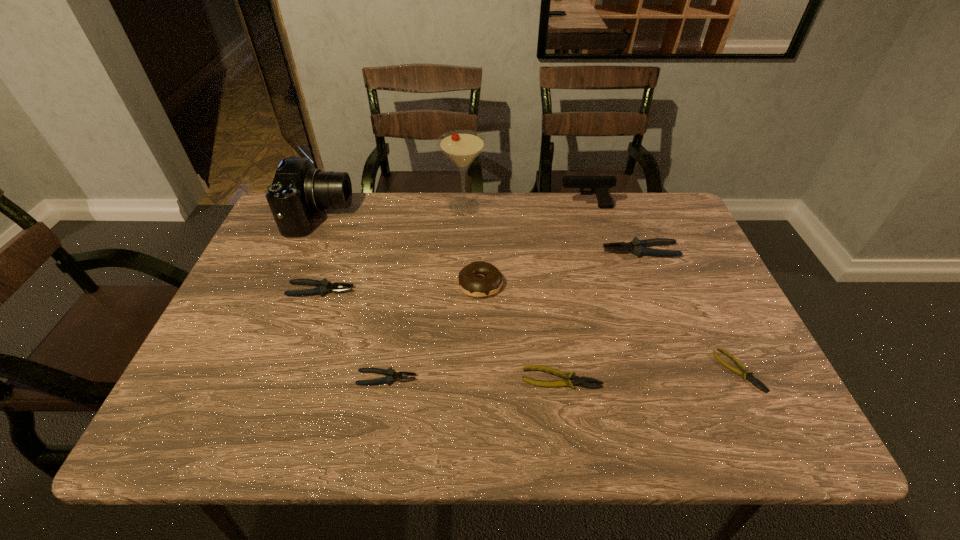
Where is `vacant point located between the second shortest pliers and the fifth shortest object`? vacant point located between the second shortest pliers and the fifth shortest object is located at coordinates (601, 315).

At what (x,y) coordinates should I click in order to perform the action: click on free space between the bigger yellow pliers and the camera. Please return your answer as a coordinate pair (x, y). The width and height of the screenshot is (960, 540). Looking at the image, I should click on (441, 296).

Find the location of `vacant area between the brown doughnut and the pistol`. vacant area between the brown doughnut and the pistol is located at coordinates (533, 245).

Where is `free area in between the tallest object and the biggest gray pliers`? free area in between the tallest object and the biggest gray pliers is located at coordinates (552, 229).

The width and height of the screenshot is (960, 540). What are the coordinates of `empty space between the fourth tallest object and the third pliers from left to right` in the screenshot? It's located at (520, 331).

Locate an element on the screen. vacant space in between the shortest pliers and the camera is located at coordinates click(x=529, y=293).

Where is `free space between the nearest gray pliers and the third pliers from right to left`? The height and width of the screenshot is (540, 960). free space between the nearest gray pliers and the third pliers from right to left is located at coordinates (474, 379).

I want to click on blank region between the doughnut and the shortest object, so click(x=610, y=327).

This screenshot has width=960, height=540. In order to click on the fifth closest object relative to the seventh object from right to left in this screenshot , I will do `click(462, 147)`.

Where is `object that is the closest to the martini`? The width and height of the screenshot is (960, 540). object that is the closest to the martini is located at coordinates (491, 282).